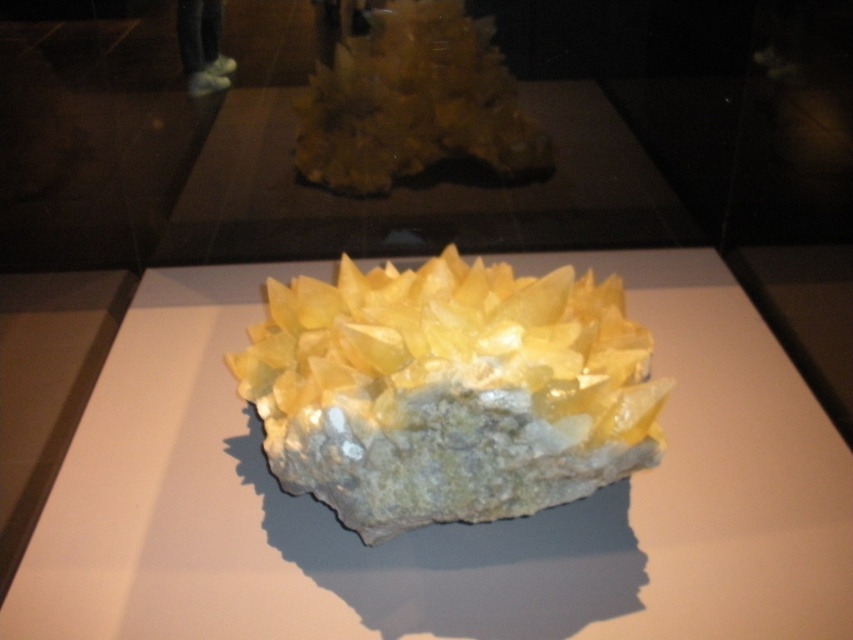
Question: Does translucent yellow crystal at center appear under yellow crystal at center?

Choices:
 (A) no
 (B) yes

Answer: (B)

Question: Can you confirm if translucent yellow crystal at center is positioned below yellow crystal at center?

Choices:
 (A) no
 (B) yes

Answer: (B)

Question: Which point is farther to the camera?

Choices:
 (A) yellow crystal at center
 (B) translucent yellow crystal at center

Answer: (A)

Question: Can you confirm if translucent yellow crystal at center is smaller than yellow crystal at center?

Choices:
 (A) yes
 (B) no

Answer: (B)